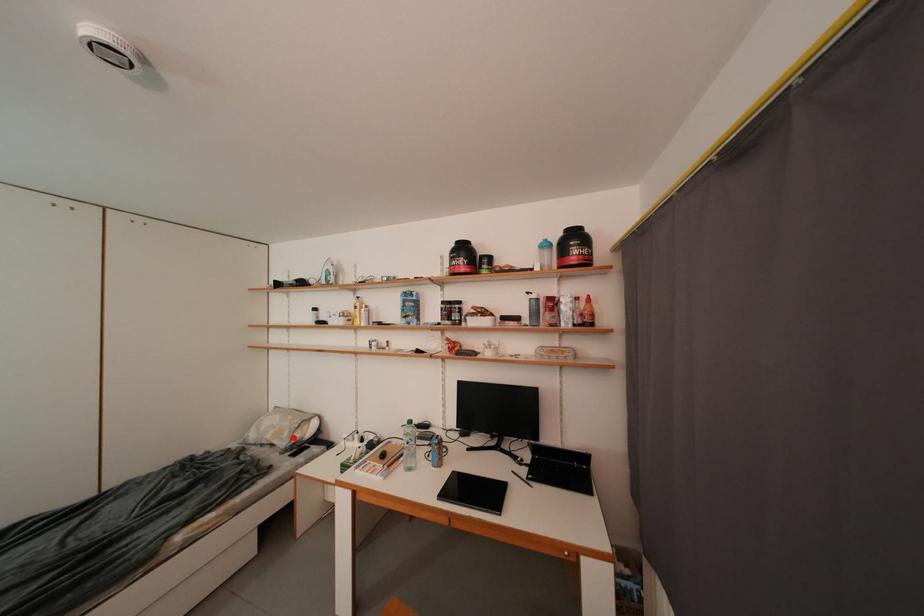
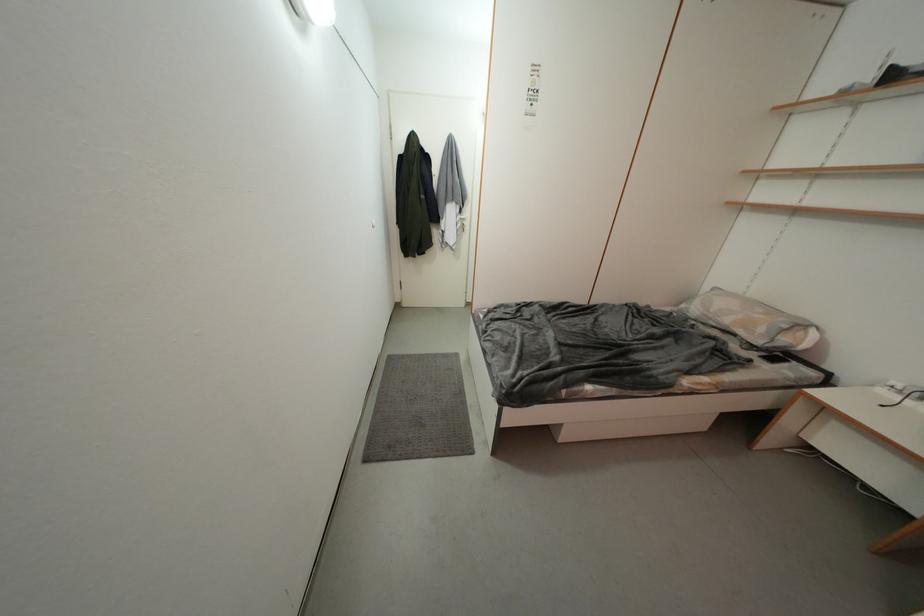
In the second image, find the point that corresponds to the highlighted location in the first image.

(769, 333)